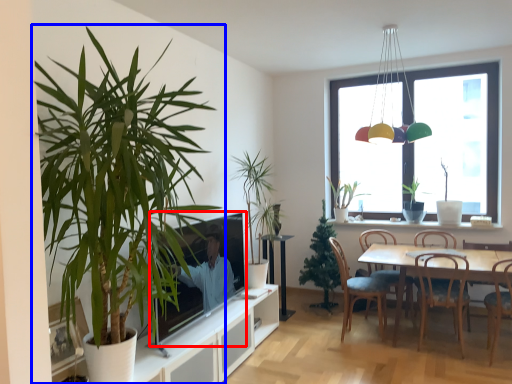
Question: Among these objects, which one is farthest to the camera, television (highlighted by a red box) or houseplant (highlighted by a blue box)?

Choices:
 (A) television
 (B) houseplant

Answer: (A)